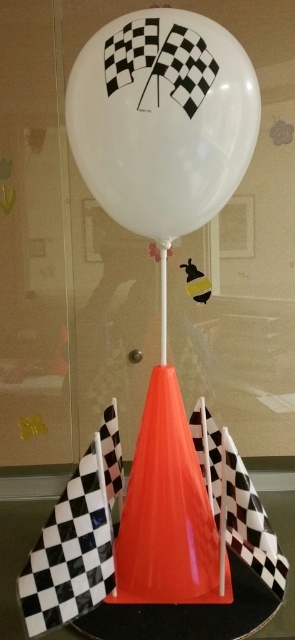
Question: Among these points, which one is farthest from the camera?

Choices:
 (A) (292, 518)
 (B) (182, 218)
 (C) (51, 577)
 (D) (164, 360)

Answer: (A)

Question: Does orange glossy traffic cone at center appear over black checkered flag at lower left?

Choices:
 (A) yes
 (B) no

Answer: (A)

Question: Which point is farther to the camera?

Choices:
 (A) orange glossy traffic cone at center
 (B) white glossy balloon at center
 (C) glossy plastic cone at center

Answer: (A)

Question: Which of the following is the farthest from the observer?

Choices:
 (A) [33, 544]
 (B) [105, 141]
 (C) [163, 348]

Answer: (A)

Question: Is the position of orange glossy traffic cone at center more distant than that of glossy plastic cone at center?

Choices:
 (A) no
 (B) yes

Answer: (B)

Question: Does white glossy balloon at center have a larger size compared to black checkered flag at lower left?

Choices:
 (A) yes
 (B) no

Answer: (A)